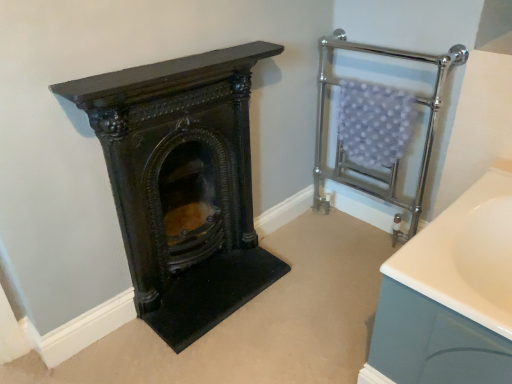
Question: From the image's perspective, is dark brown wood at left positioned above or below chrome metallic towel rack at upper right?

Choices:
 (A) below
 (B) above

Answer: (A)

Question: Considering the positions of dark brown wood at left and chrome metallic towel rack at upper right in the image, is dark brown wood at left taller or shorter than chrome metallic towel rack at upper right?

Choices:
 (A) short
 (B) tall

Answer: (A)

Question: Looking at the image, does dark brown wood at left seem bigger or smaller compared to chrome metallic towel rack at upper right?

Choices:
 (A) big
 (B) small

Answer: (B)

Question: From the image's perspective, is chrome metallic towel rack at upper right above or below dark brown wood at left?

Choices:
 (A) above
 (B) below

Answer: (A)

Question: Looking at their shapes, would you say chrome metallic towel rack at upper right is wider or thinner than dark brown wood at left?

Choices:
 (A) wide
 (B) thin

Answer: (A)

Question: Considering the positions of point (334, 77) and point (155, 228), is point (334, 77) closer or farther from the camera than point (155, 228)?

Choices:
 (A) farther
 (B) closer

Answer: (A)

Question: Is chrome metallic towel rack at upper right to the left or to the right of dark brown wood at left in the image?

Choices:
 (A) left
 (B) right

Answer: (B)